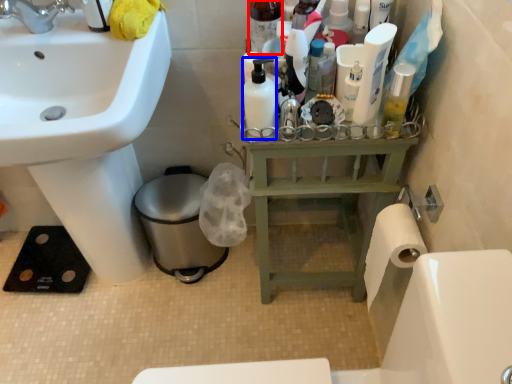
Question: Among these objects, which one is nearest to the camera, toiletry (highlighted by a red box) or mouthwash (highlighted by a blue box)?

Choices:
 (A) toiletry
 (B) mouthwash

Answer: (B)